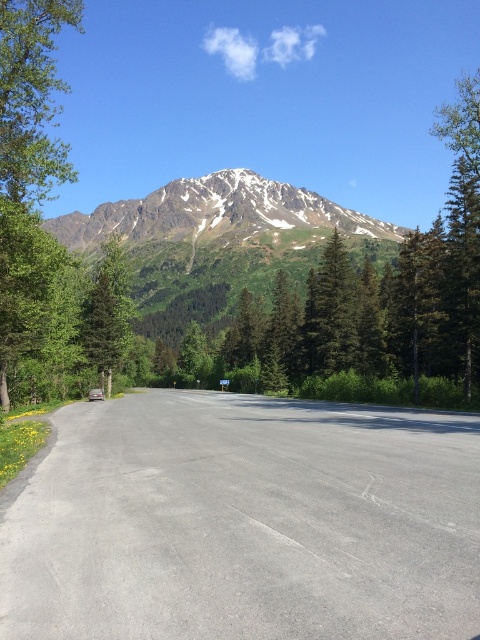
You are a hiker standing at the beginning of the gray asphalt road at center. You want to reach the green textured tree at center. Which direction should you walk to get closer to the tree?

The gray asphalt road at center is located below the green textured tree at center, so you should walk upwards along the gray asphalt road at center to reach the tree.

Looking at this image, you are a hiker standing at the starting point of the road. You see the snowy granite mountain at upper center and the green textured tree at center. Which object is positioned to the left when looking towards the mountain?

The snowy granite mountain at upper center is positioned to the left of the green textured tree at center, so the snowy granite mountain at upper center is the one on the left.

You are standing at the starting point of the road and want to reach the mountain in the background. There are two points marked on the road, point A at coordinates point (x=211, y=228) and point B at coordinates point (x=332, y=301). Which point should you walk towards first to get closer to the mountain?

You should walk towards point B at coordinates point (x=332, y=301) first because point A at coordinates point (x=211, y=228) is closer to you and point B is further away towards the mountain.